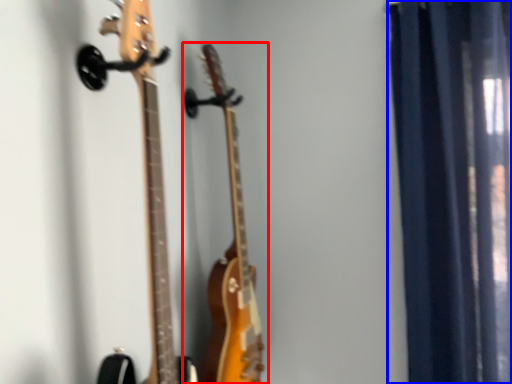
Question: Which of the following is the farthest to the observer, guitar (highlighted by a red box) or curtain (highlighted by a blue box)?

Choices:
 (A) guitar
 (B) curtain

Answer: (B)